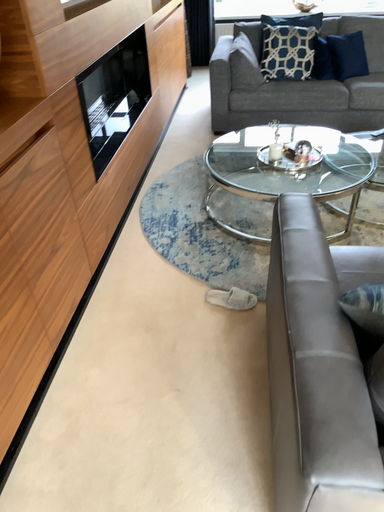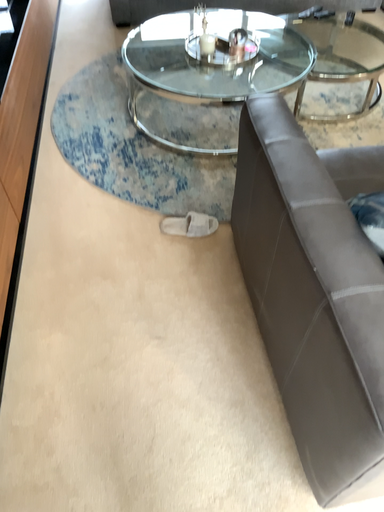
Question: Which way did the camera rotate in the video?

Choices:
 (A) rotated right
 (B) rotated left

Answer: (A)